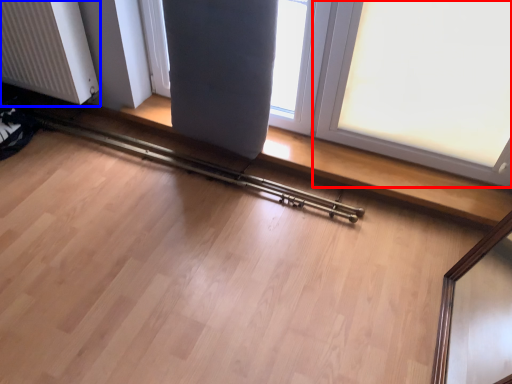
Question: Which object appears closest to the camera in this image, window (highlighted by a red box) or radiator (highlighted by a blue box)?

Choices:
 (A) window
 (B) radiator

Answer: (A)